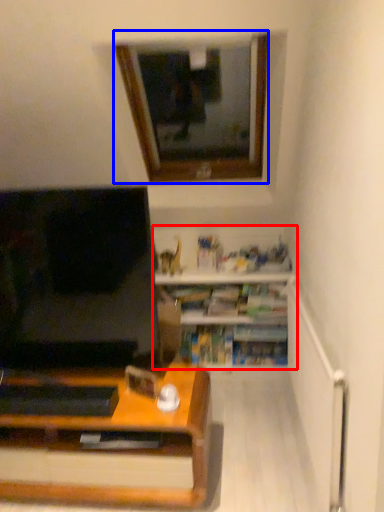
Question: Which object is closer to the camera taking this photo, shelf (highlighted by a red box) or window (highlighted by a blue box)?

Choices:
 (A) shelf
 (B) window

Answer: (B)